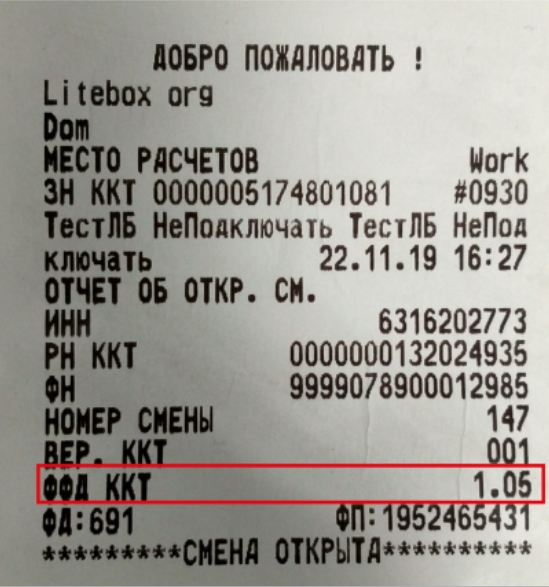
Identify the location of box. (204, 480).